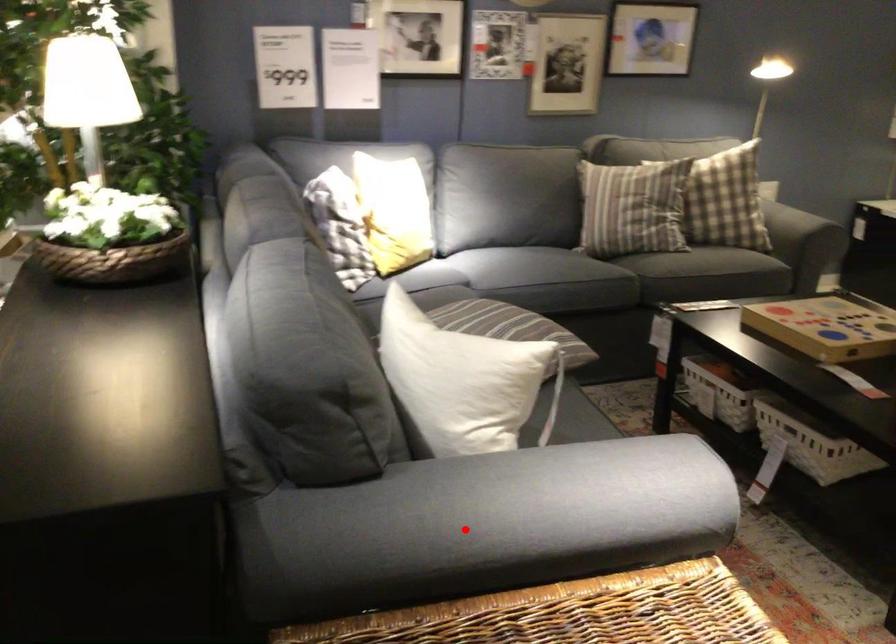
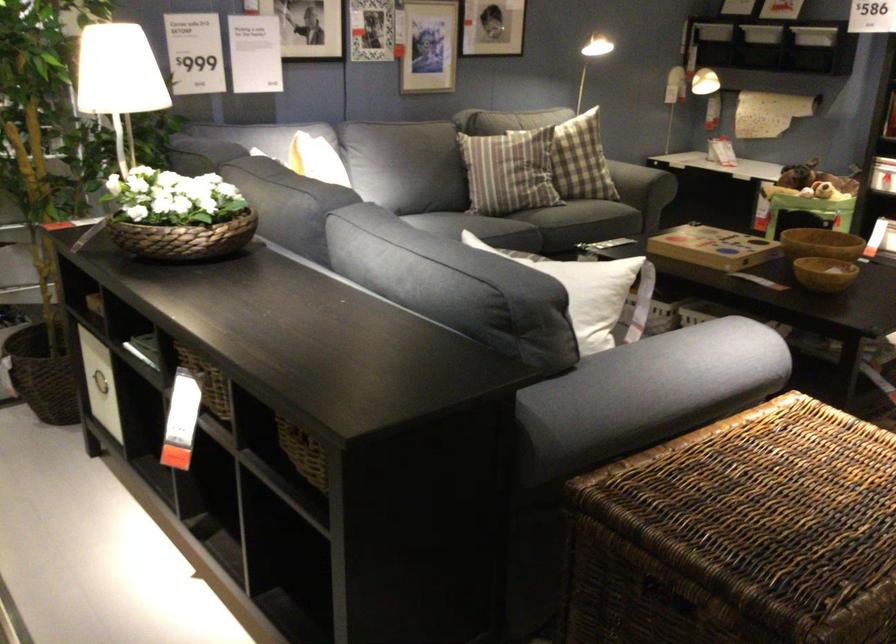
Question: I am providing you with two images of the same scene from different viewpoints. Given a red point in image1, look at the same physical point in image2. Is it:

Choices:
 (A) Closer to the viewpoint
 (B) Farther from the viewpoint

Answer: (B)